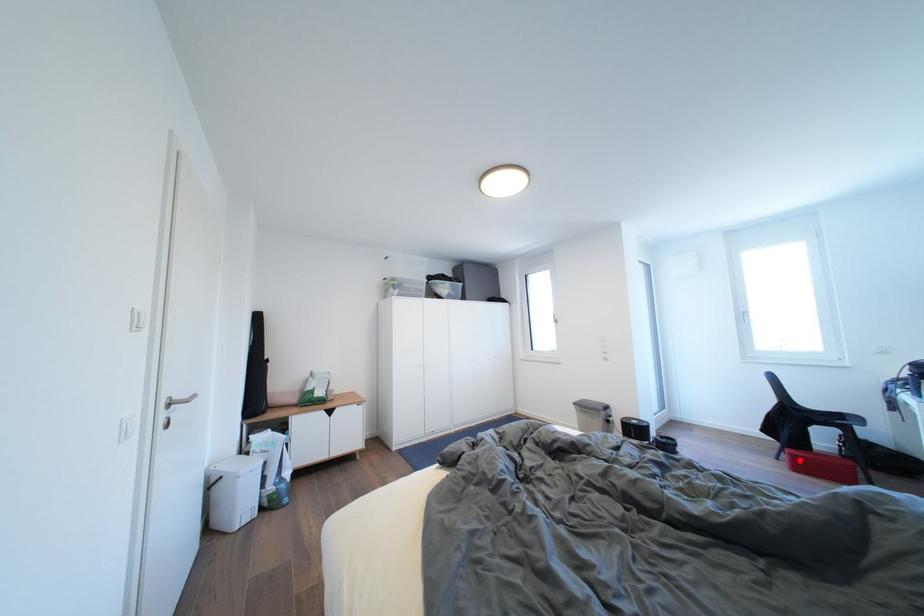
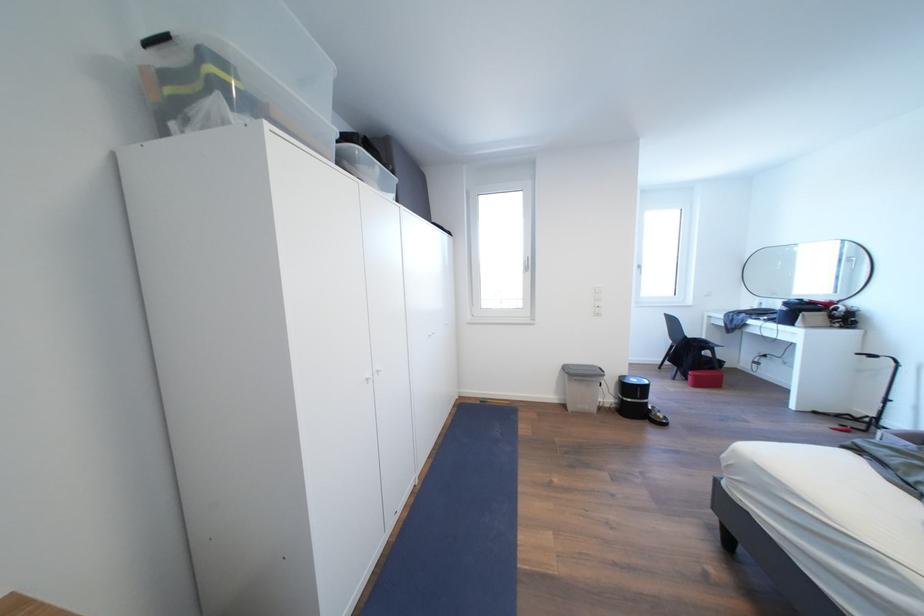
Question: I am providing you with two images of the same scene from different viewpoints. A red point is shown in image1. For the corresponding object point in image2, is it positioned nearer or farther from the camera?

Choices:
 (A) Nearer
 (B) Farther

Answer: (A)